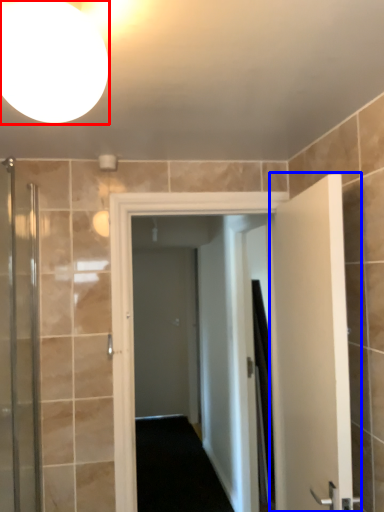
Question: Among these objects, which one is farthest to the camera, light fixture (highlighted by a red box) or door (highlighted by a blue box)?

Choices:
 (A) light fixture
 (B) door

Answer: (B)